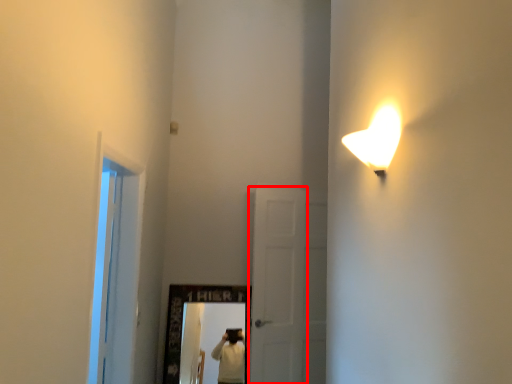
Question: From the image's perspective, what is the correct spatial positioning of door (annotated by the red box) in reference to window?

Choices:
 (A) below
 (B) above

Answer: (A)